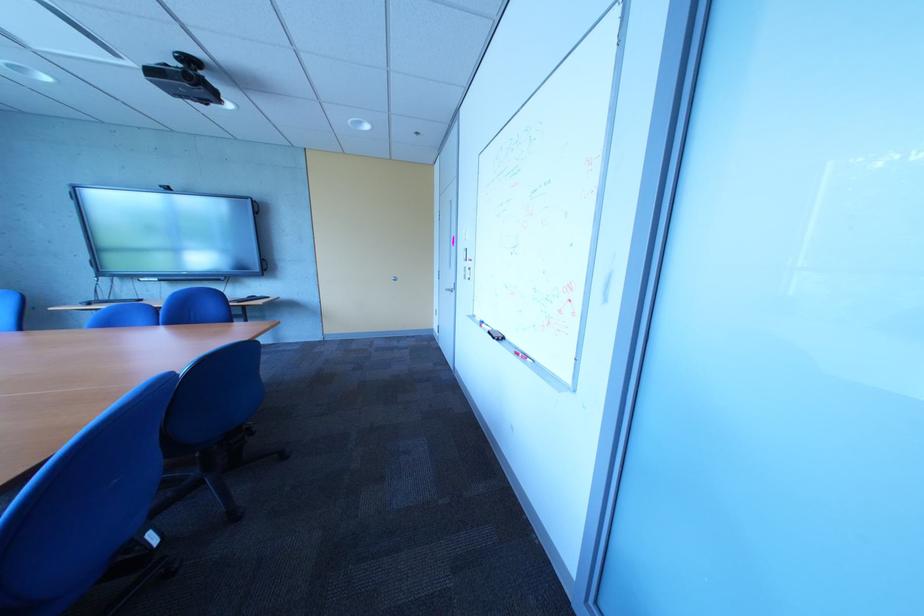
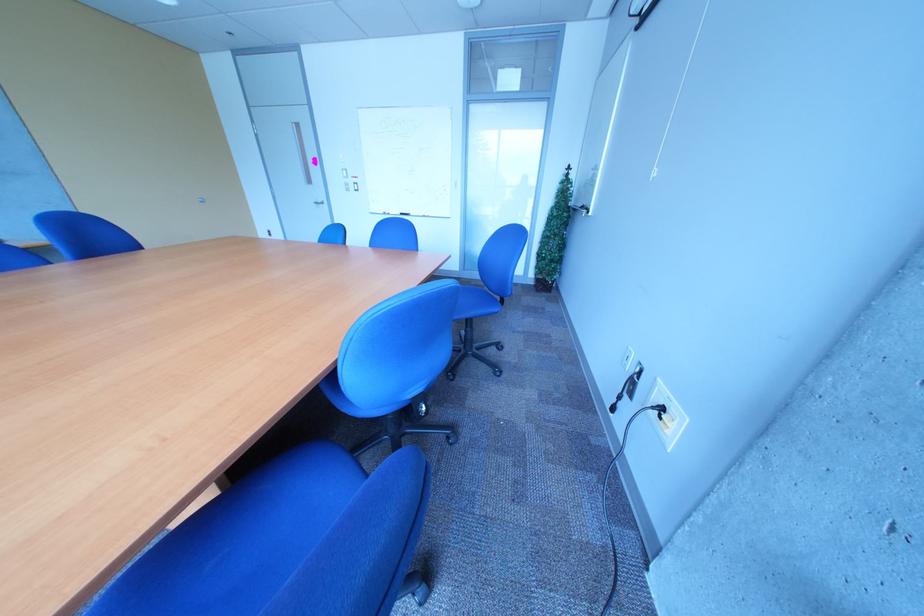
Where in the second image is the point corresponding to point (496, 328) from the first image?

(405, 216)